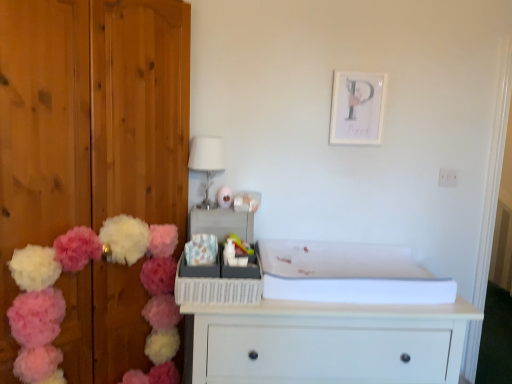
Locate an element on the screen. fluffy yarn pom-poms at left is located at coordinates (80, 269).

What do you see at coordinates (224, 197) in the screenshot? I see `matte plastic toy at center` at bounding box center [224, 197].

Measure the distance between matte plastic toy at center and camera.

The depth of matte plastic toy at center is 6.19 feet.

This screenshot has width=512, height=384. Identify the location of white matte picture frame at upper center. (357, 108).

Describe the element at coordinates (357, 108) in the screenshot. The height and width of the screenshot is (384, 512). I see `white matte picture frame at upper center` at that location.

The image size is (512, 384). Find the location of `fluffy yarn pom-poms at left`. fluffy yarn pom-poms at left is located at coordinates point(80,269).

Which of these two, wooden door at left or matte plastic toy at center, is thinner?

matte plastic toy at center is thinner.

Could you tell me if wooden door at left is turned towards matte plastic toy at center?

No, wooden door at left is not turned towards matte plastic toy at center.

Does wooden door at left have a smaller size compared to matte plastic toy at center?

No.

Is point (16, 188) behind point (223, 205)?

No, it is not.

Considering the sizes of white matte chest of drawers at center and white matte picture frame at upper center in the image, is white matte chest of drawers at center taller or shorter than white matte picture frame at upper center?

Considering their sizes, white matte chest of drawers at center has more height than white matte picture frame at upper center.

What are the coordinates of `chest of drawers on the left of white matte picture frame at upper center` in the screenshot? It's located at (328, 342).

From the image's perspective, which is below, white matte chest of drawers at center or white matte picture frame at upper center?

white matte chest of drawers at center appears lower in the image.

From a real-world perspective, is white matte chest of drawers at center above or below white matte picture frame at upper center?

In terms of real-world spatial position, white matte chest of drawers at center is below white matte picture frame at upper center.

Considering the sizes of objects fluffy yarn pom-poms at left and white matte chest of drawers at center in the image provided, who is smaller, fluffy yarn pom-poms at left or white matte chest of drawers at center?

With smaller size is fluffy yarn pom-poms at left.

Based on their positions, is fluffy yarn pom-poms at left located to the left or right of white matte chest of drawers at center?

In the image, fluffy yarn pom-poms at left appears on the left side of white matte chest of drawers at center.

Can you tell me how much fluffy yarn pom-poms at left and white matte chest of drawers at center differ in facing direction?

fluffy yarn pom-poms at left and white matte chest of drawers at center are facing 39.9 degrees away from each other.

Is fluffy yarn pom-poms at left behind white matte chest of drawers at center?

No, it is in front of white matte chest of drawers at center.

Between point (207, 196) and point (81, 190), which one is positioned behind?

Point (207, 196)

Based on the photo, would you say white glossy lampshade at upper center is a long distance from wooden door at left?

No.

Locate an element on the screen. door on the left of white glossy lampshade at upper center is located at coordinates (89, 123).

Does white glossy lampshade at upper center appear on the right side of white matte picture frame at upper center?

Incorrect, white glossy lampshade at upper center is not on the right side of white matte picture frame at upper center.

Can you confirm if white glossy lampshade at upper center is smaller than white matte picture frame at upper center?

Incorrect, white glossy lampshade at upper center is not smaller in size than white matte picture frame at upper center.

How many degrees apart are the facing directions of white glossy lampshade at upper center and white matte picture frame at upper center?

The angular difference between white glossy lampshade at upper center and white matte picture frame at upper center is 1.67 degrees.

From a real-world perspective, is fluffy fabric flower at center positioned above or below wooden door at left?

From a real-world perspective, fluffy fabric flower at center is physically below wooden door at left.

Is fluffy fabric flower at center thinner than wooden door at left?

Correct, the width of fluffy fabric flower at center is less than that of wooden door at left.

Is fluffy fabric flower at center aimed at wooden door at left?

No, fluffy fabric flower at center does not turn towards wooden door at left.

Is fluffy fabric flower at center smaller than wooden door at left?

Indeed, fluffy fabric flower at center has a smaller size compared to wooden door at left.

From the image's perspective, which is below, white matte chest of drawers at center or fluffy fabric flower at center?

From the image's view, white matte chest of drawers at center is below.

Is white matte chest of drawers at center facing away from fluffy fabric flower at center?

No, white matte chest of drawers at center is not facing the opposite direction of fluffy fabric flower at center.

Is white matte chest of drawers at center not near fluffy fabric flower at center?

white matte chest of drawers at center is actually quite close to fluffy fabric flower at center.

The image size is (512, 384). I want to click on chest of drawers on the right of the fluffy fabric flower at center, so [x=328, y=342].

The height and width of the screenshot is (384, 512). Identify the location of door below the matte plastic toy at center (from the image's perspective). (89, 123).

Where is `chest of drawers to the left of white matte picture frame at upper center`? The image size is (512, 384). chest of drawers to the left of white matte picture frame at upper center is located at coordinates (328, 342).

Which object lies further to the anchor point wooden door at left, white glossy lampshade at upper center or fluffy fabric flower at center?

The object further to wooden door at left is fluffy fabric flower at center.

When comparing their distances from fluffy fabric flower at center, does white matte chest of drawers at center or white matte picture frame at upper center seem closer?

white matte chest of drawers at center lies closer to fluffy fabric flower at center than the other object.

When comparing their distances from white glossy lampshade at upper center, does matte plastic toy at center or fluffy yarn pom-poms at left seem closer?

matte plastic toy at center is closer to white glossy lampshade at upper center.

Estimate the real-world distances between objects in this image. Which object is closer to wooden door at left, fluffy fabric flower at center or white glossy lampshade at upper center?

Based on the image, white glossy lampshade at upper center appears to be nearer to wooden door at left.

Based on their spatial positions, is wooden door at left or fluffy yarn pom-poms at left closer to white matte picture frame at upper center?

wooden door at left is positioned closer to the anchor white matte picture frame at upper center.

Considering their positions, is wooden door at left positioned further to white glossy lampshade at upper center than white matte picture frame at upper center?

The object further to white glossy lampshade at upper center is white matte picture frame at upper center.

Based on their spatial positions, is fluffy fabric flower at center or white matte chest of drawers at center further from white matte picture frame at upper center?

white matte chest of drawers at center is positioned further to the anchor white matte picture frame at upper center.

Based on their spatial positions, is white glossy lampshade at upper center or wooden door at left further from white matte picture frame at upper center?

wooden door at left lies further to white matte picture frame at upper center than the other object.

At what (x,y) coordinates should I click in order to perform the action: click on toy between wooden door at left and white matte picture frame at upper center in the horizontal direction. Please return your answer as a coordinate pair (x, y). This screenshot has width=512, height=384. Looking at the image, I should click on (224, 197).

Image resolution: width=512 pixels, height=384 pixels. I want to click on flower between white glossy lampshade at upper center and white matte chest of drawers at center vertically, so point(201,250).

What are the coordinates of `flower between white matte picture frame at upper center and white matte chest of drawers at center in the vertical direction` in the screenshot? It's located at pos(201,250).

Where is `lamp located between fluffy fabric flower at center and white matte picture frame at upper center in the left-right direction`? Image resolution: width=512 pixels, height=384 pixels. lamp located between fluffy fabric flower at center and white matte picture frame at upper center in the left-right direction is located at coordinates (206, 162).